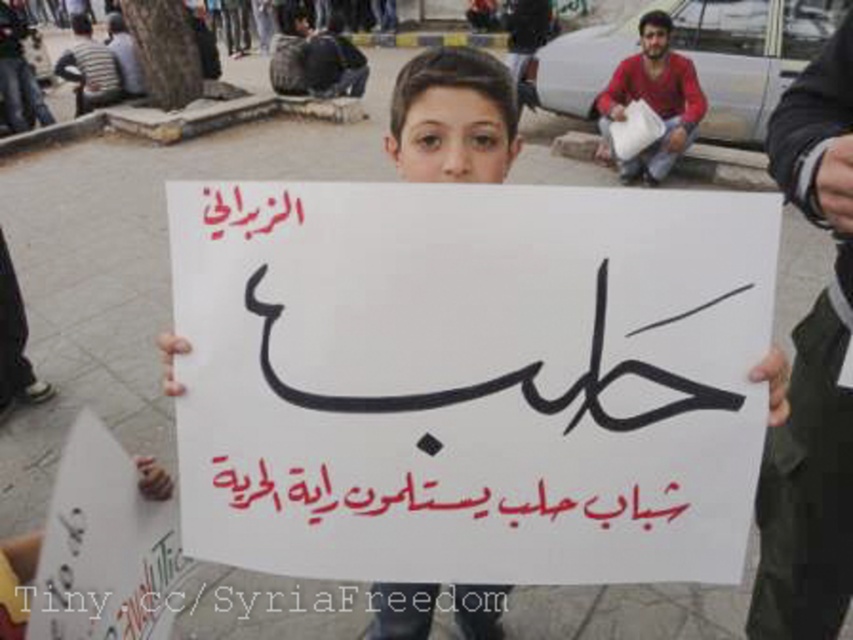
Question: Considering the relative positions of white paper sign at center and white paper at center in the image provided, where is white paper sign at center located with respect to white paper at center?

Choices:
 (A) right
 (B) left

Answer: (A)

Question: Is white paper at center wider than red cotton shirt at upper right?

Choices:
 (A) no
 (B) yes

Answer: (A)

Question: Which point is farther from the camera taking this photo?

Choices:
 (A) (627, 168)
 (B) (521, 522)

Answer: (A)

Question: Which of the following is the closest to the observer?

Choices:
 (A) (503, 490)
 (B) (424, 81)
 (C) (593, 387)

Answer: (C)

Question: Does white paper at center have a smaller size compared to red cotton shirt at upper right?

Choices:
 (A) no
 (B) yes

Answer: (B)

Question: Which object is the farthest from the white paper at center?

Choices:
 (A) red cotton shirt at upper right
 (B) red calligraphy at center

Answer: (A)